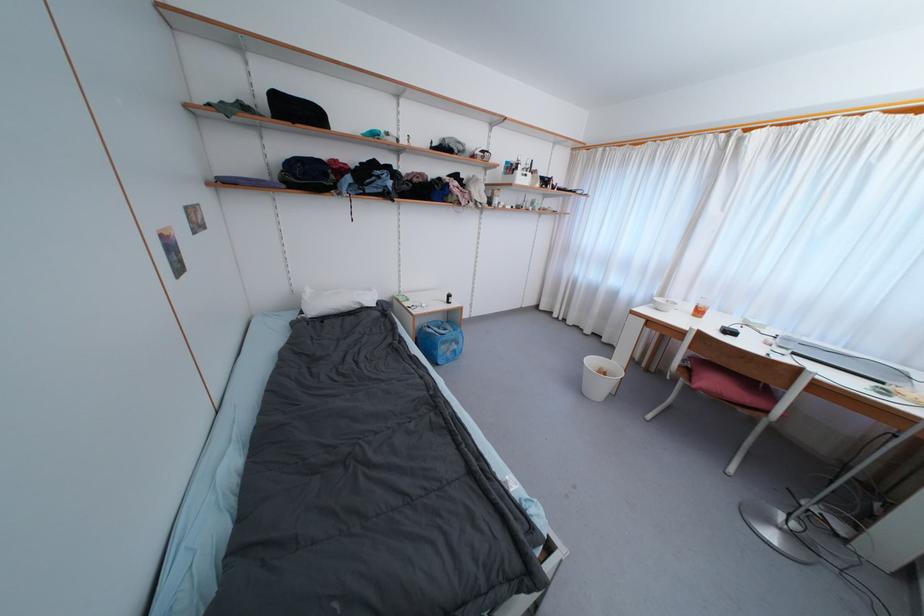
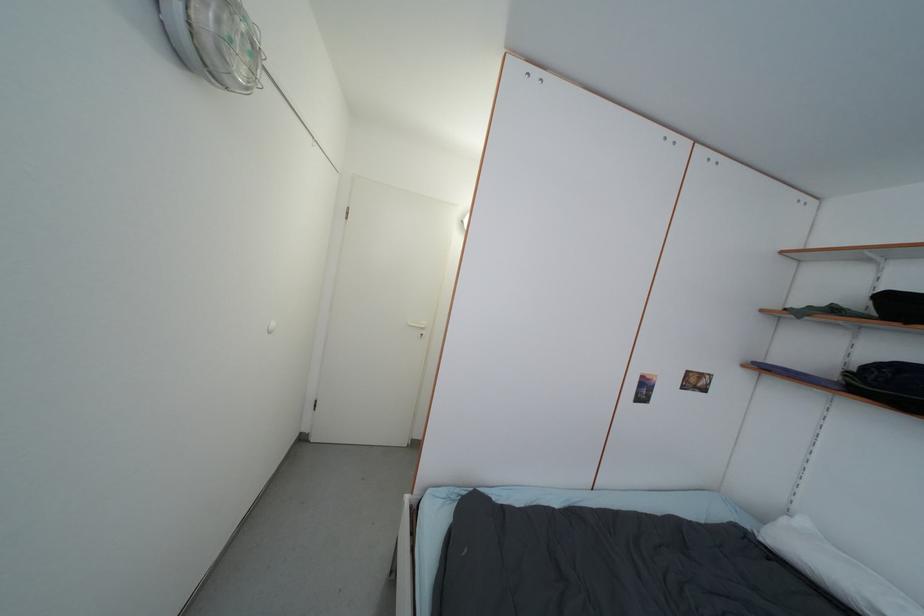
Question: Based on the continuous images, in which direction is the camera rotating? Reply with the corresponding letter.

Choices:
 (A) Left
 (B) Right
 (C) Up
 (D) Down

Answer: (A)